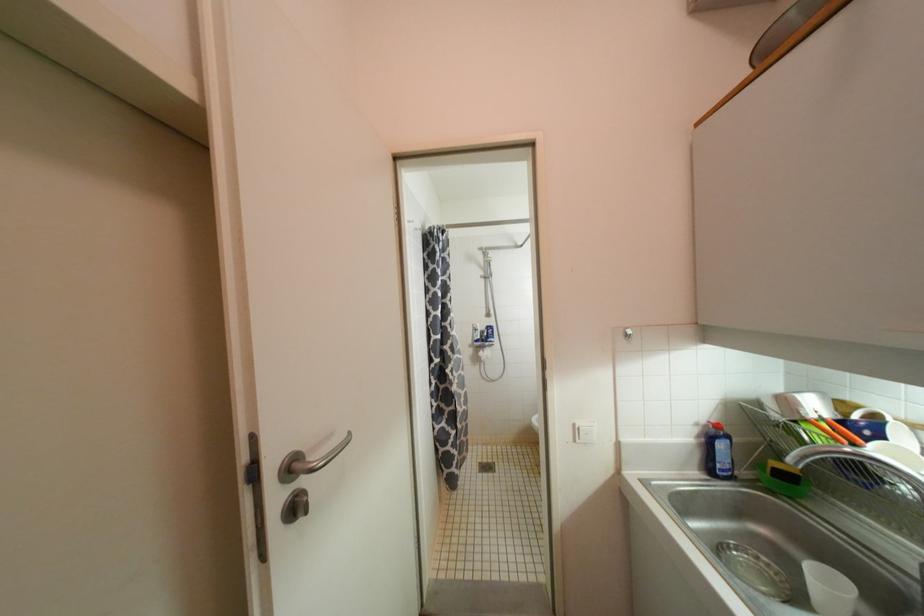
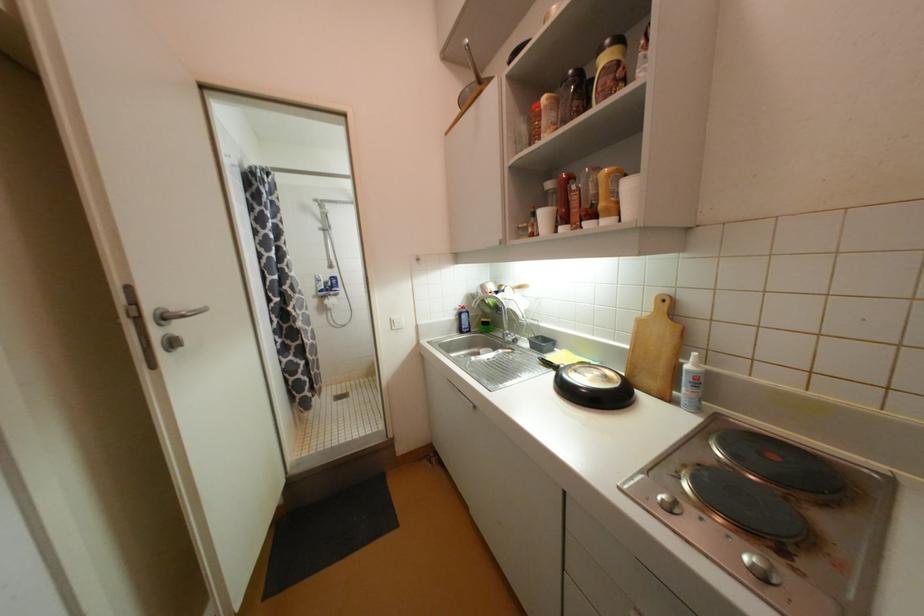
Find the pixel in the second image that matches pixel 317 472 in the first image.

(188, 318)